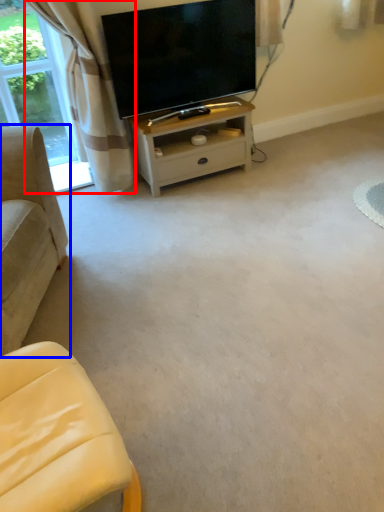
Question: Which point is closer to the camera, curtain (highlighted by a red box) or studio couch (highlighted by a blue box)?

Choices:
 (A) curtain
 (B) studio couch

Answer: (B)